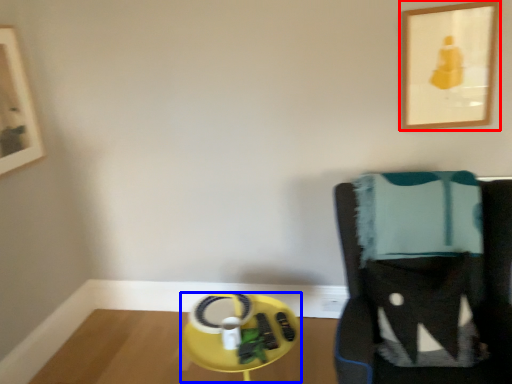
Question: Which object appears farthest to the camera in this image, picture frame (highlighted by a red box) or round table (highlighted by a blue box)?

Choices:
 (A) picture frame
 (B) round table

Answer: (A)